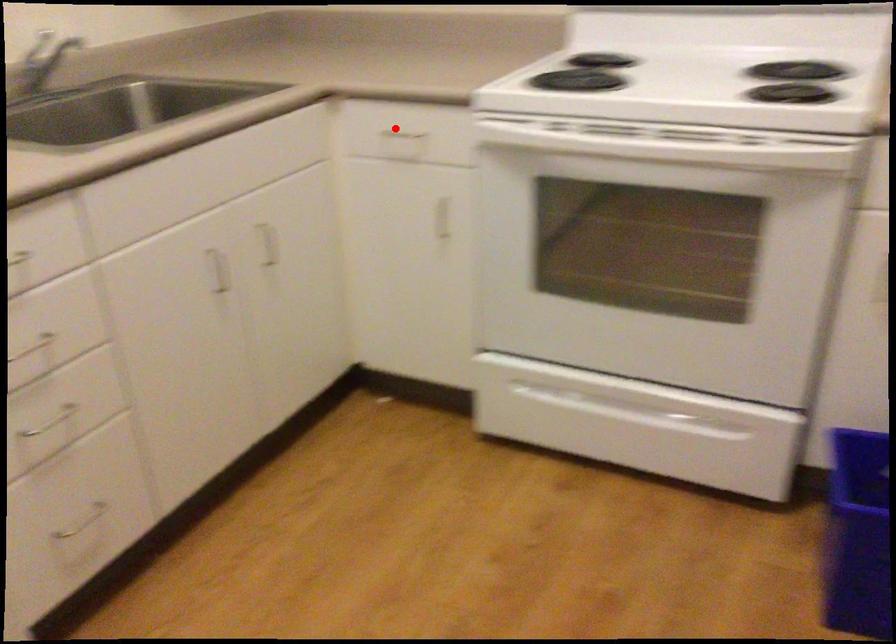
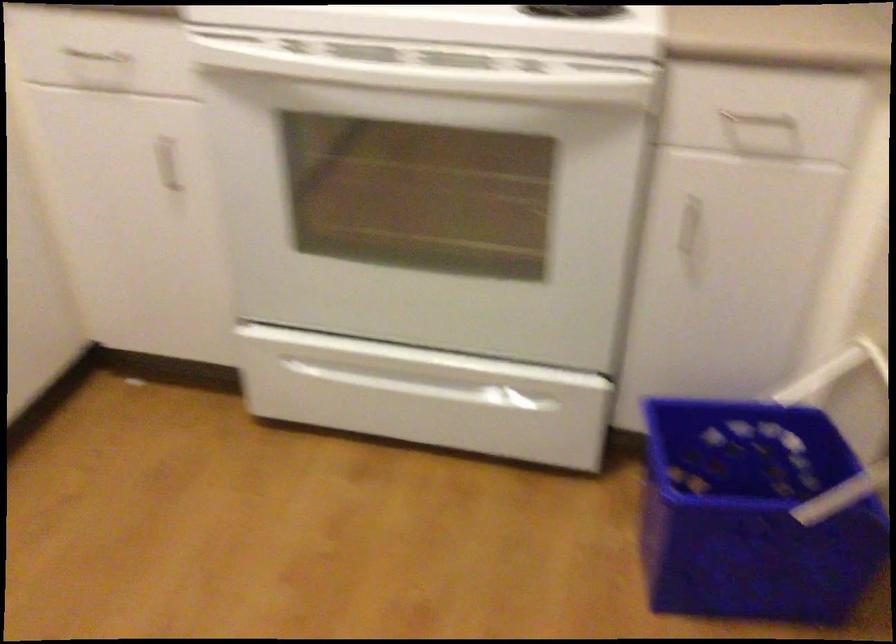
Find the pixel in the second image that matches the highlighted location in the first image.

(97, 57)